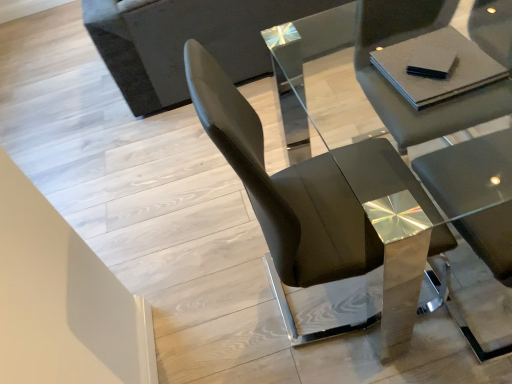
Question: Is matte gray chair at center, the second chair in the left-to-right sequence, facing away from glossy black chair at center, which appears as the 1th chair when viewed from the left?

Choices:
 (A) no
 (B) yes

Answer: (A)

Question: Is matte gray chair at center, the second chair in the left-to-right sequence, wider than glossy black chair at center, the second chair from the right?

Choices:
 (A) no
 (B) yes

Answer: (B)

Question: From a real-world perspective, is matte gray chair at center, arranged as the 1th chair when viewed from the right, located higher than glossy black chair at center, which appears as the 1th chair when viewed from the left?

Choices:
 (A) no
 (B) yes

Answer: (A)

Question: Does matte gray chair at center, the second chair in the left-to-right sequence, appear on the right side of glossy black chair at center, which appears as the 1th chair when viewed from the left?

Choices:
 (A) yes
 (B) no

Answer: (A)

Question: Is matte gray chair at center, the second chair in the left-to-right sequence, not near glossy black chair at center, the second chair from the right?

Choices:
 (A) yes
 (B) no

Answer: (B)

Question: Is dark gray fabric couch at upper left spatially inside matte gray chair at center, the second chair in the left-to-right sequence, or outside of it?

Choices:
 (A) inside
 (B) outside

Answer: (B)

Question: In the image, is dark gray fabric couch at upper left positioned in front of or behind matte gray chair at center, the second chair in the left-to-right sequence?

Choices:
 (A) behind
 (B) front

Answer: (A)

Question: From a real-world perspective, is dark gray fabric couch at upper left above or below matte gray chair at center, arranged as the 1th chair when viewed from the right?

Choices:
 (A) above
 (B) below

Answer: (B)

Question: Considering the positions of dark gray fabric couch at upper left and matte gray chair at center, the second chair in the left-to-right sequence, in the image, is dark gray fabric couch at upper left taller or shorter than matte gray chair at center, the second chair in the left-to-right sequence,?

Choices:
 (A) tall
 (B) short

Answer: (B)

Question: Relative to dark gray fabric couch at upper left, is matte gray chair at center, the second chair in the left-to-right sequence, in front or behind?

Choices:
 (A) front
 (B) behind

Answer: (A)

Question: In terms of height, does matte gray chair at center, the second chair in the left-to-right sequence, look taller or shorter compared to dark gray fabric couch at upper left?

Choices:
 (A) short
 (B) tall

Answer: (B)

Question: Do you think matte gray chair at center, arranged as the 1th chair when viewed from the right, is within dark gray fabric couch at upper left, or outside of it?

Choices:
 (A) inside
 (B) outside

Answer: (B)

Question: Is matte gray chair at center, arranged as the 1th chair when viewed from the right, wider or thinner than dark gray fabric couch at upper left?

Choices:
 (A) thin
 (B) wide

Answer: (A)

Question: Considering the relative positions of glossy black chair at center, the second chair from the right, and black matte pad at upper right in the image provided, is glossy black chair at center, the second chair from the right, to the left or to the right of black matte pad at upper right?

Choices:
 (A) left
 (B) right

Answer: (A)

Question: From the image's perspective, is glossy black chair at center, which appears as the 1th chair when viewed from the left, above or below black matte pad at upper right?

Choices:
 (A) below
 (B) above

Answer: (A)